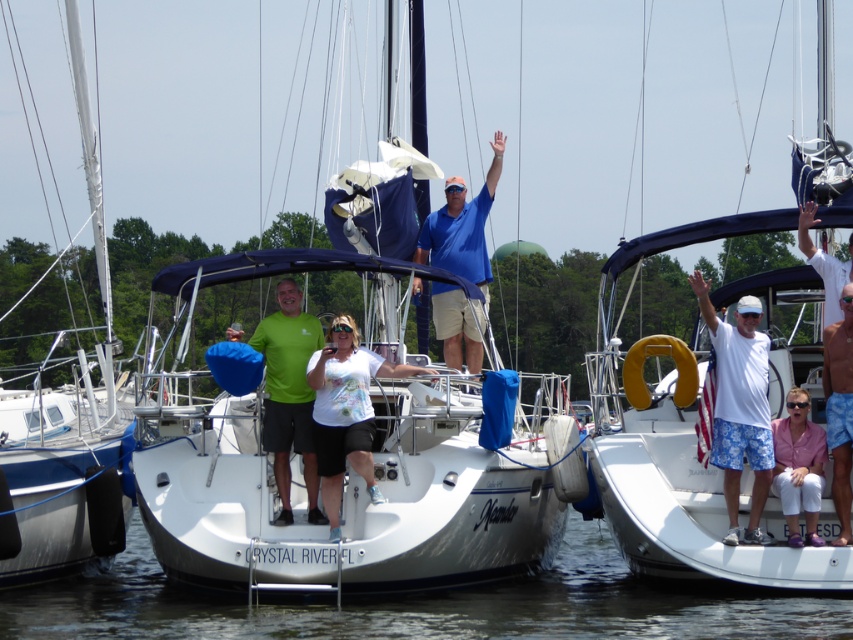
Is point (592, 618) farther from viewer compared to point (288, 314)?

No.

Where is `clear water at lower center`? clear water at lower center is located at coordinates (421, 604).

Between green matte shirt at center and blue cotton shirt at center, which one has more height?

blue cotton shirt at center is taller.

Which is in front, point (306, 419) or point (469, 212)?

Point (306, 419)

Which is in front, point (288, 376) or point (482, 262)?

Point (288, 376) is more forward.

Find the location of a particular element. green matte shirt at center is located at coordinates (289, 394).

The height and width of the screenshot is (640, 853). What do you see at coordinates (360, 442) in the screenshot?
I see `white matte sailboat at center` at bounding box center [360, 442].

Does white matte sailboat at center have a greater height compared to white matte shirt at center?

Indeed, white matte sailboat at center has a greater height compared to white matte shirt at center.

Is point (351, 556) farther from viewer compared to point (338, 433)?

No, (351, 556) is in front of (338, 433).

In order to click on white matte sailboat at center in this screenshot , I will do `click(360, 442)`.